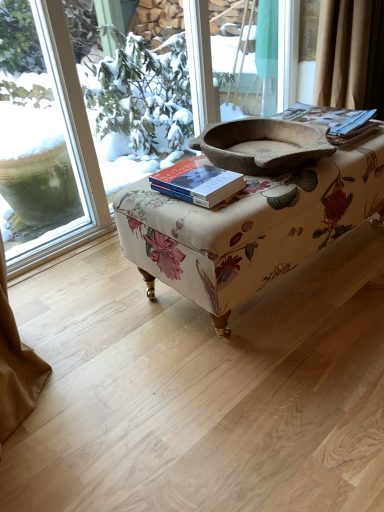
What are the coordinates of `vacant area that is in front of floral fabric ottoman at center` in the screenshot? It's located at (264, 381).